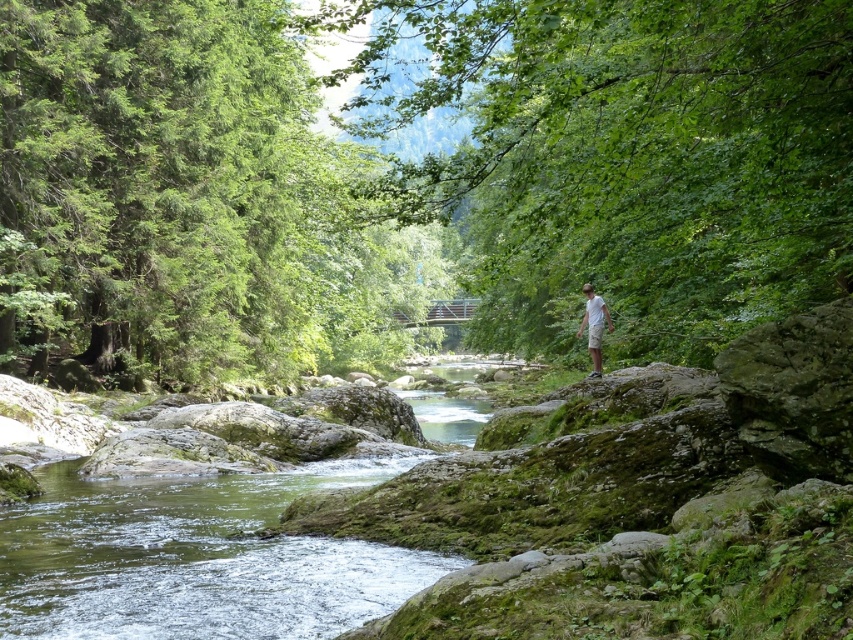
Locate an element on the screen. The height and width of the screenshot is (640, 853). green leafy tree at center is located at coordinates (621, 156).

Consider the image. Is green leafy tree at center further to the viewer compared to white cotton shirt at center?

No, green leafy tree at center is closer to the viewer.

This screenshot has width=853, height=640. What are the coordinates of `green leafy tree at center` in the screenshot? It's located at (621, 156).

Does green leafy tree at center have a greater height compared to green leafy tree at upper left?

Correct, green leafy tree at center is much taller as green leafy tree at upper left.

Does green leafy tree at center have a lesser height compared to green leafy tree at upper left?

In fact, green leafy tree at center may be taller than green leafy tree at upper left.

You are a GUI agent. You are given a task and a screenshot of the screen. Output one action in this format:
    pyautogui.click(x=<x>, y=<y>)
    Task: Click on the green leafy tree at center
    The width and height of the screenshot is (853, 640).
    Given the screenshot: What is the action you would take?
    pyautogui.click(x=621, y=156)

Identify the location of green leafy tree at center. (621, 156).

Can you confirm if green leafy tree at upper left is positioned below green mossy water at center?

Incorrect, green leafy tree at upper left is not positioned below green mossy water at center.

Who is taller, green leafy tree at upper left or green mossy water at center?

green leafy tree at upper left

This screenshot has height=640, width=853. I want to click on green leafy tree at upper left, so click(x=187, y=198).

Locate an element on the screen. green leafy tree at upper left is located at coordinates (187, 198).